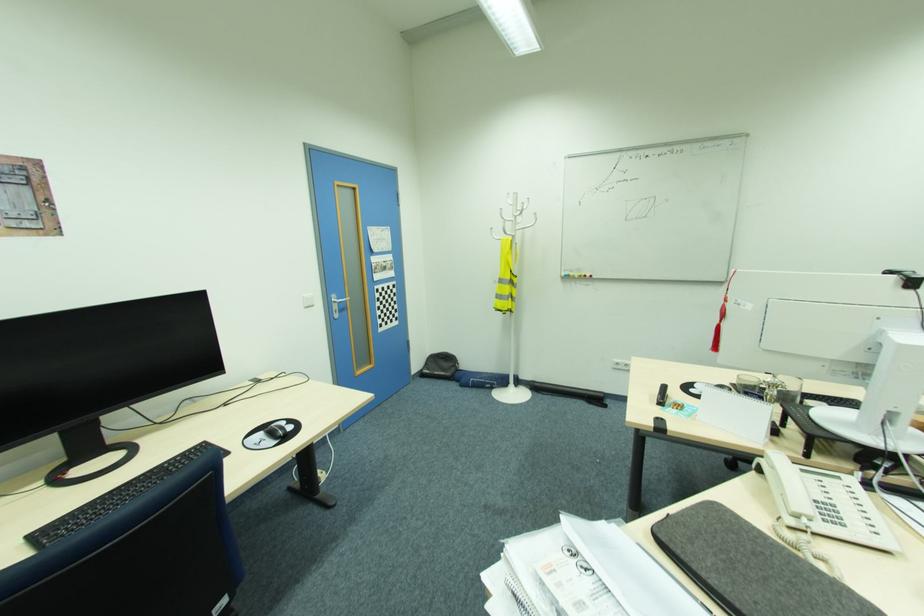
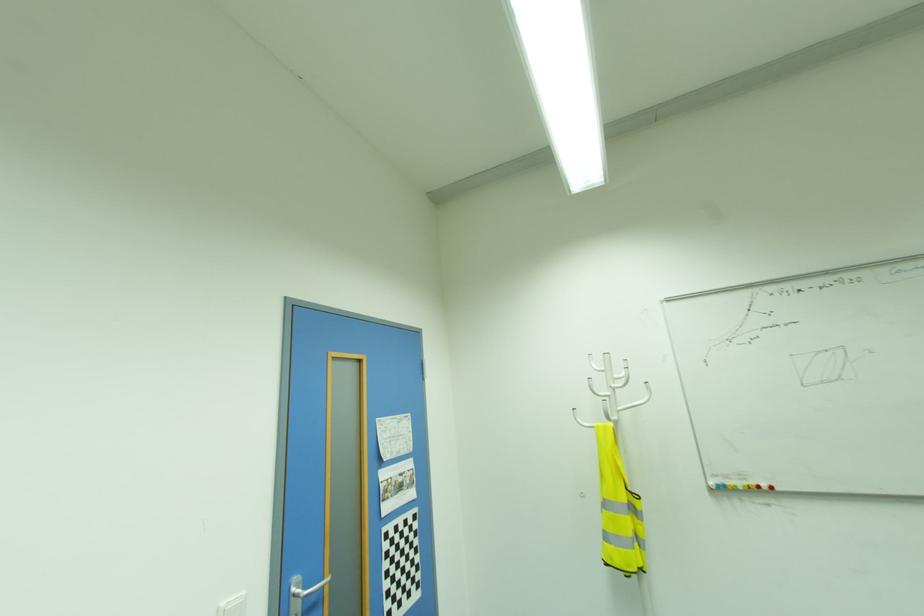
Find the pixel in the second image that matches [499,238] in the first image.

(589, 424)